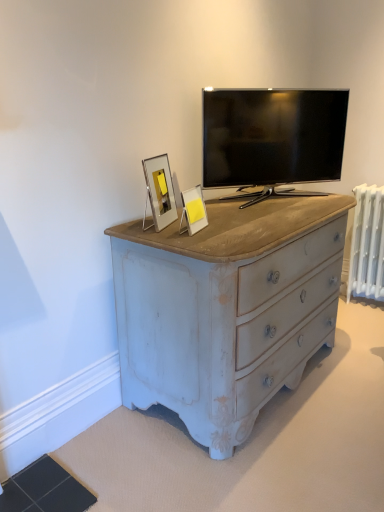
Question: Does black glossy tv at upper center have a lesser width compared to white painted metal radiator at right?

Choices:
 (A) no
 (B) yes

Answer: (A)

Question: Can you confirm if black glossy tv at upper center is taller than white painted metal radiator at right?

Choices:
 (A) no
 (B) yes

Answer: (A)

Question: Is black glossy tv at upper center positioned with its back to white painted metal radiator at right?

Choices:
 (A) yes
 (B) no

Answer: (B)

Question: From a real-world perspective, is black glossy tv at upper center below white painted metal radiator at right?

Choices:
 (A) yes
 (B) no

Answer: (B)

Question: Considering the relative sizes of black glossy tv at upper center and white painted metal radiator at right in the image provided, is black glossy tv at upper center smaller than white painted metal radiator at right?

Choices:
 (A) yes
 (B) no

Answer: (B)

Question: Can we say black glossy tv at upper center lies outside white painted metal radiator at right?

Choices:
 (A) no
 (B) yes

Answer: (B)

Question: From a real-world perspective, is white painted metal radiator at right positioned under matte white picture frame at center, which appears as the second picture frame when viewed from the left, based on gravity?

Choices:
 (A) no
 (B) yes

Answer: (B)

Question: Is matte white picture frame at center, which appears as the second picture frame when viewed from the left, inside white painted metal radiator at right?

Choices:
 (A) yes
 (B) no

Answer: (B)

Question: Considering the relative sizes of white painted metal radiator at right and matte white picture frame at center, which appears as the second picture frame when viewed from the left, in the image provided, is white painted metal radiator at right thinner than matte white picture frame at center, which appears as the second picture frame when viewed from the left,?

Choices:
 (A) yes
 (B) no

Answer: (B)

Question: Is white painted metal radiator at right not within matte white picture frame at center, the first picture frame when ordered from right to left?

Choices:
 (A) no
 (B) yes

Answer: (B)

Question: Considering the relative sizes of white painted metal radiator at right and matte white picture frame at center, the first picture frame when ordered from right to left, in the image provided, is white painted metal radiator at right taller than matte white picture frame at center, the first picture frame when ordered from right to left,?

Choices:
 (A) no
 (B) yes

Answer: (B)

Question: Can you confirm if white painted metal radiator at right is smaller than matte white picture frame at center, which appears as the second picture frame when viewed from the left?

Choices:
 (A) yes
 (B) no

Answer: (B)

Question: Can you confirm if matte white picture frame at center, the first picture frame when ordered from right to left, is smaller than white painted metal radiator at right?

Choices:
 (A) yes
 (B) no

Answer: (A)